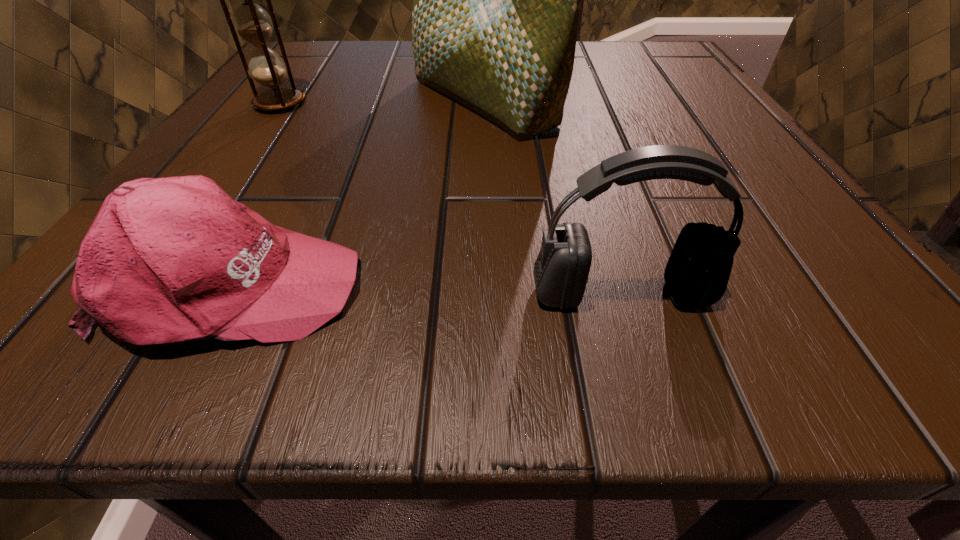
Find the location of a particular element. Image resolution: width=960 pixels, height=540 pixels. baseball cap that is at the near edge is located at coordinates (174, 259).

This screenshot has height=540, width=960. I want to click on hourglass at the left edge, so click(x=251, y=21).

Find the location of a particular element. baseball cap at the left edge is located at coordinates (174, 259).

Where is `object present at the right edge`? object present at the right edge is located at coordinates (697, 273).

The width and height of the screenshot is (960, 540). I want to click on object present at the far left corner, so click(251, 21).

The width and height of the screenshot is (960, 540). In order to click on object at the near left corner in this screenshot , I will do `click(174, 259)`.

You are a GUI agent. You are given a task and a screenshot of the screen. Output one action in this format:
    pyautogui.click(x=<x>, y=<y>)
    Task: Click on the object present at the near right corner
    
    Given the screenshot: What is the action you would take?
    pyautogui.click(x=697, y=273)

In the image, there is a desktop. Identify the location of free space at the far edge. This screenshot has width=960, height=540. (408, 78).

Where is `vacant space at the left edge of the desktop`? The height and width of the screenshot is (540, 960). vacant space at the left edge of the desktop is located at coordinates (337, 98).

Find the location of a particular element. Image resolution: width=960 pixels, height=540 pixels. vacant space at the right edge of the desktop is located at coordinates (728, 207).